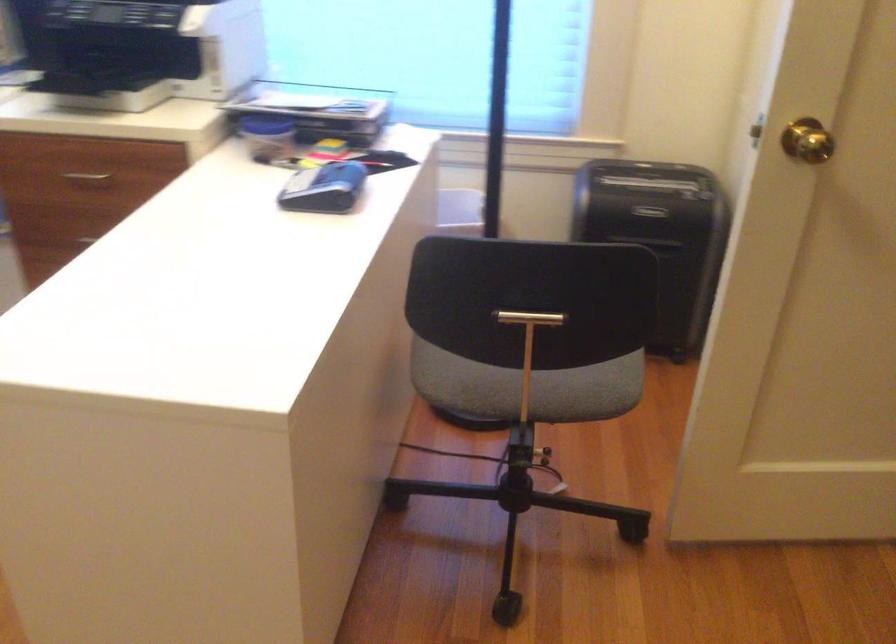
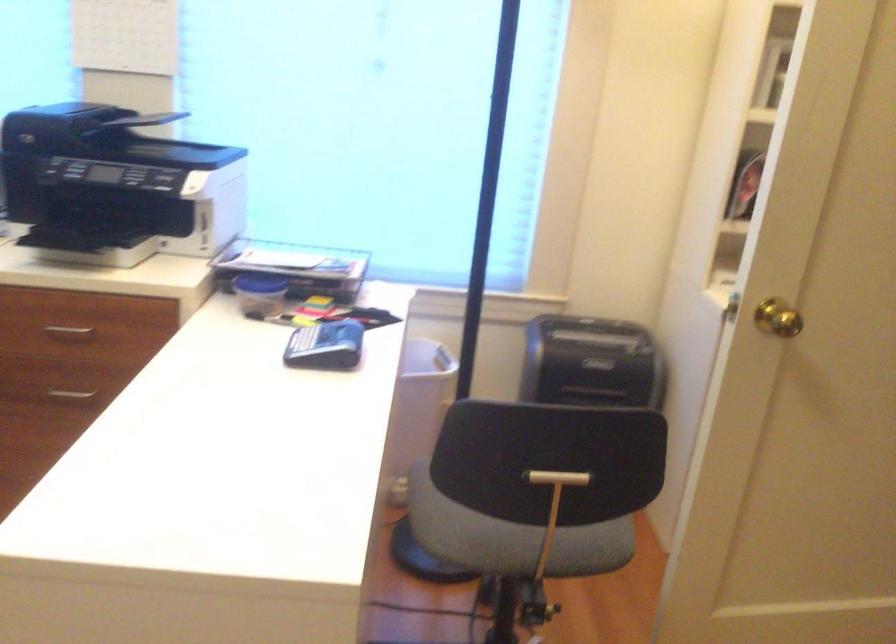
Question: Which direction would the cameraman need to move to produce the second image? Reply with the corresponding letter.

Choices:
 (A) Left
 (B) Right
 (C) Forward
 (D) Backward

Answer: (A)